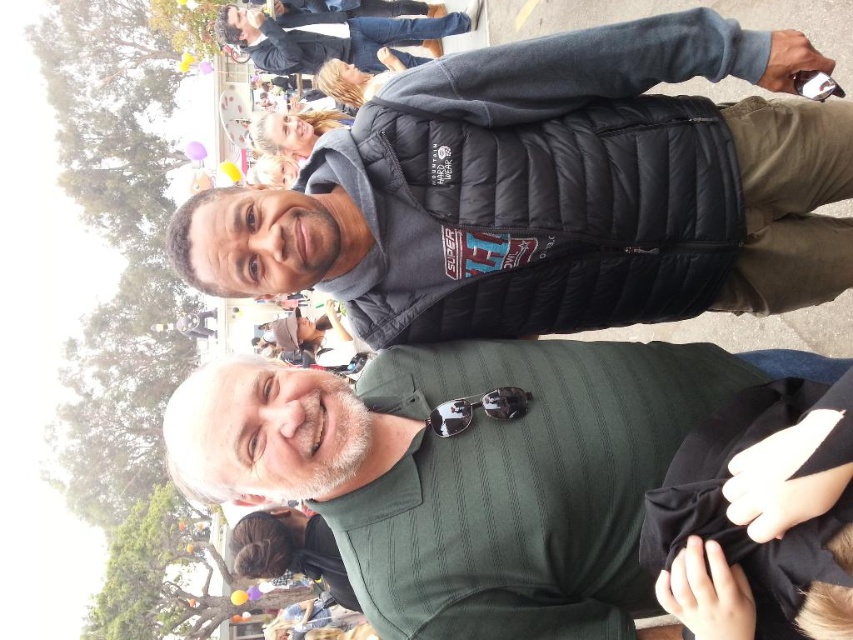
Question: Is dark gray puffer vest at upper center smaller than black quilted jacket at upper center?

Choices:
 (A) no
 (B) yes

Answer: (A)

Question: Which object is the closest to the sunglasses at center?

Choices:
 (A) green striped shirt at center
 (B) dark gray puffer vest at upper center
 (C) black quilted jacket at upper center

Answer: (A)

Question: Which point is farther from the camera taking this photo?

Choices:
 (A) (247, 42)
 (B) (370, 452)
 (C) (476, 408)

Answer: (A)

Question: Is the position of green striped shirt at center more distant than that of dark gray puffer vest at upper center?

Choices:
 (A) no
 (B) yes

Answer: (A)

Question: Is dark gray puffer vest at upper center above black quilted jacket at upper center?

Choices:
 (A) no
 (B) yes

Answer: (A)

Question: Which of the following is the farthest from the observer?

Choices:
 (A) (444, 436)
 (B) (614, 228)

Answer: (B)